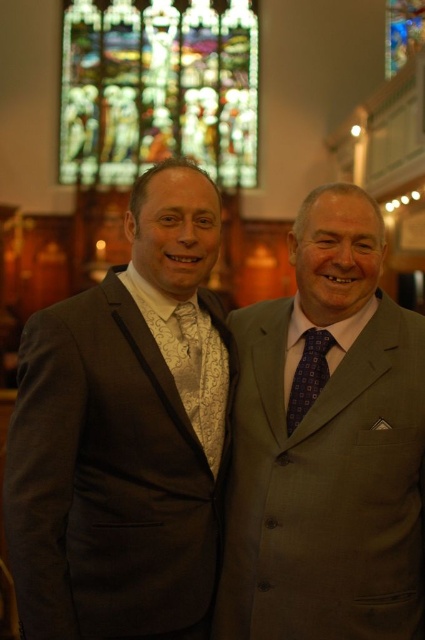
Question: Is gray wool suit at right positioned at the back of stained glass at upper center?

Choices:
 (A) no
 (B) yes

Answer: (A)

Question: Among these objects, which one is farthest from the camera?

Choices:
 (A) stained glass at upper center
 (B) dark gray wool suit at left

Answer: (A)

Question: Does dark gray wool suit at left lie behind purple dotted tie at center?

Choices:
 (A) no
 (B) yes

Answer: (A)

Question: Considering the relative positions of stained glass at upper center and stained glass window at upper center in the image provided, where is stained glass at upper center located with respect to stained glass window at upper center?

Choices:
 (A) below
 (B) above

Answer: (A)

Question: Which point is closer to the camera taking this photo?

Choices:
 (A) (54, 332)
 (B) (183, 54)

Answer: (A)

Question: Which object is positioned farthest from the purple dotted tie at center?

Choices:
 (A) stained glass window at upper center
 (B) stained glass at upper center

Answer: (A)